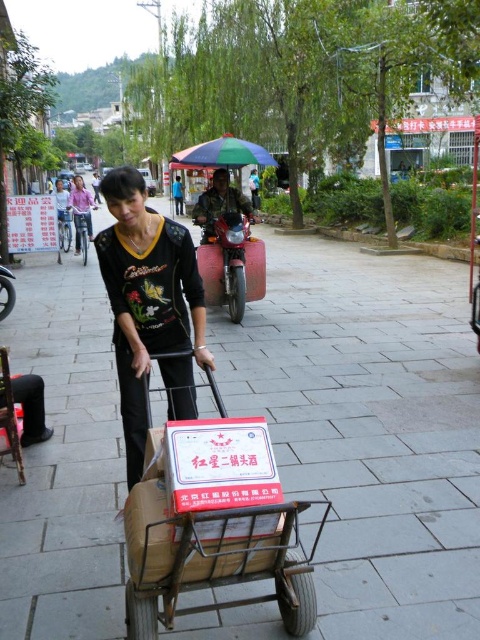
You are standing in the street scene and want to place a small flag exactly halfway between point (183, 276) and point (172, 182). Will the flag be closer to the woman pushing the cart or the background people?

The flag placed halfway between point (183, 276) and point (172, 182) will be closer to the woman pushing the cart because point (183, 276) is closer to the viewer than point (172, 182), so the midpoint is nearer to the foreground.